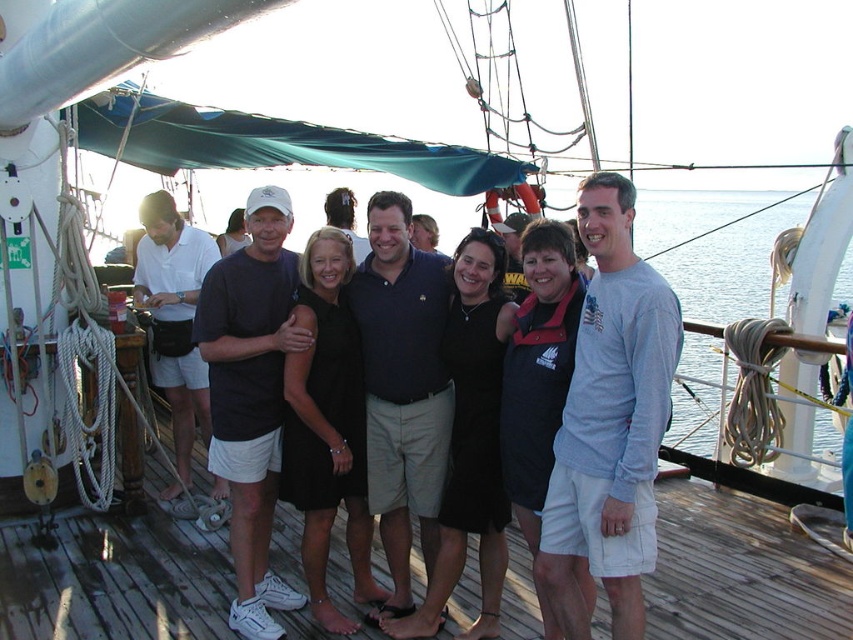
You are a photographer trying to capture the group photo of the dark blue shirt at center and dark blue polo shirt at center. Which one is positioned to the right side of the other?

The dark blue shirt at center is positioned to the right of the dark blue polo shirt at center.

You are a photographer trying to capture a clear shot of the dark blue shirt at center and the dark blue polo shirt at center. Which one is positioned lower in the image?

The dark blue shirt at center is below dark blue polo shirt at center, so the dark blue shirt at center is positioned lower in the image.